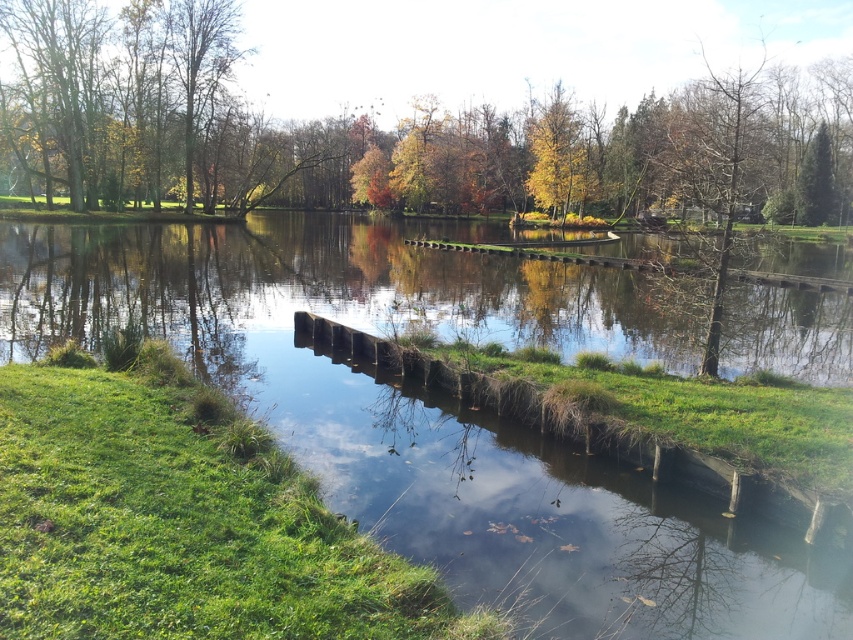
You are standing at the lakeside and want to take a photo of both point (607, 22) and point (538, 160). Which point should you focus on first to ensure both are in focus?

You should focus on point (607, 22) first because it is closer to the camera than point (538, 160), ensuring both will be in focus when using the hyperfocal distance technique.